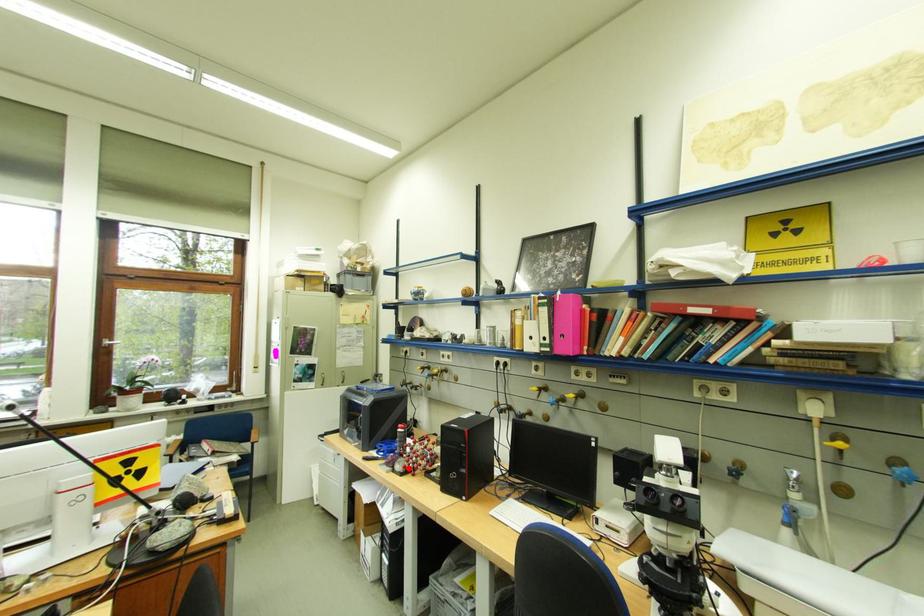
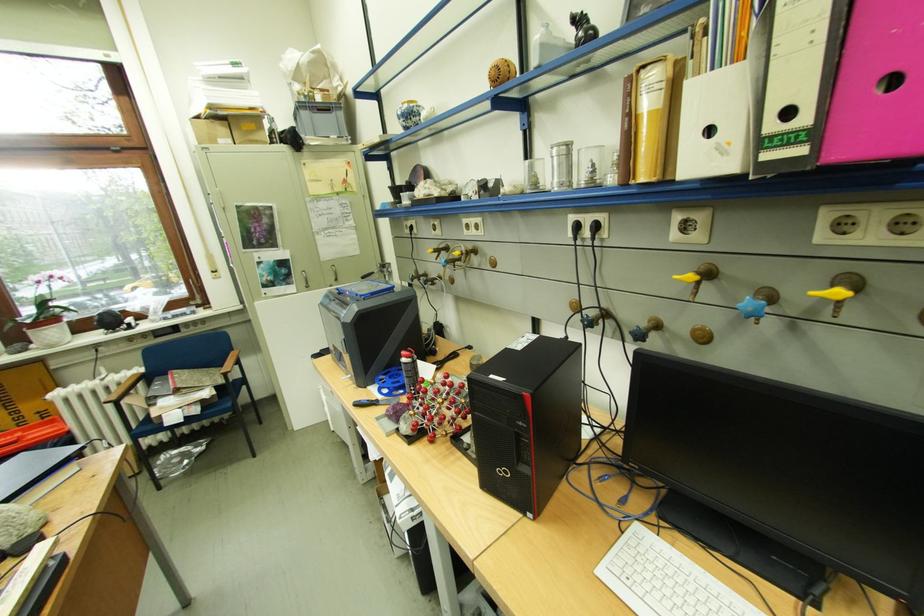
Question: I am providing you with two images of the same scene from different viewpoints. Image1 has a red point marked. In image2, the corresponding 3D location appears at what relative position? Reply with the corresponding letter.

Choices:
 (A) Closer
 (B) Farther

Answer: (A)